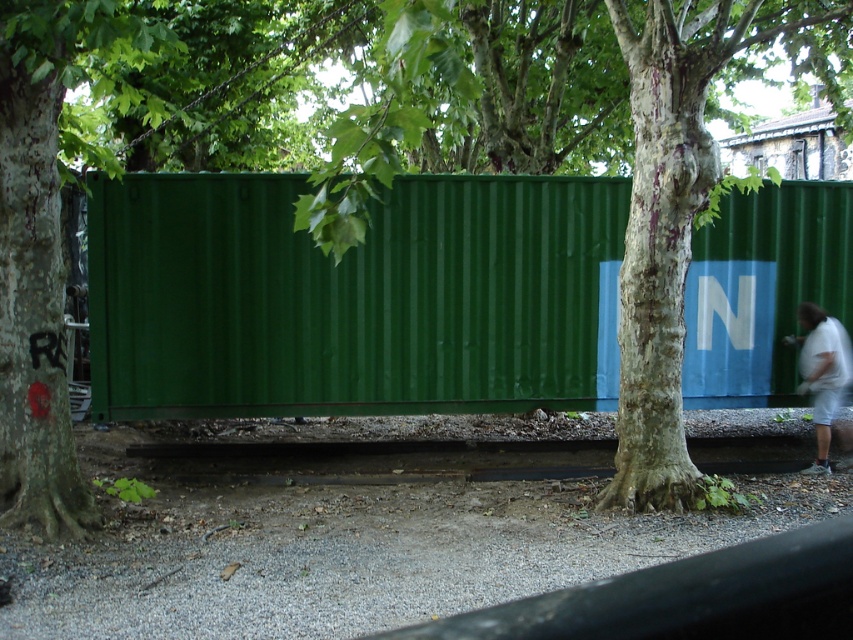
You are a delivery person trying to park your truck near the green corrugated metal shipping container at center and the white cotton shirt at right. Considering their sizes, which object should you avoid hitting to prevent damage to your truck?

The white cotton shirt at right is larger than the green corrugated metal shipping container at center, so you should avoid hitting the white cotton shirt at right to prevent damage to your truck.

You are standing at the point marked by the coordinates point (352, 298) in the image. What object are you directly facing?

The point (352, 298) indicates green corrugated metal shipping container at center, so you are directly facing the green corrugated metal shipping container at center.